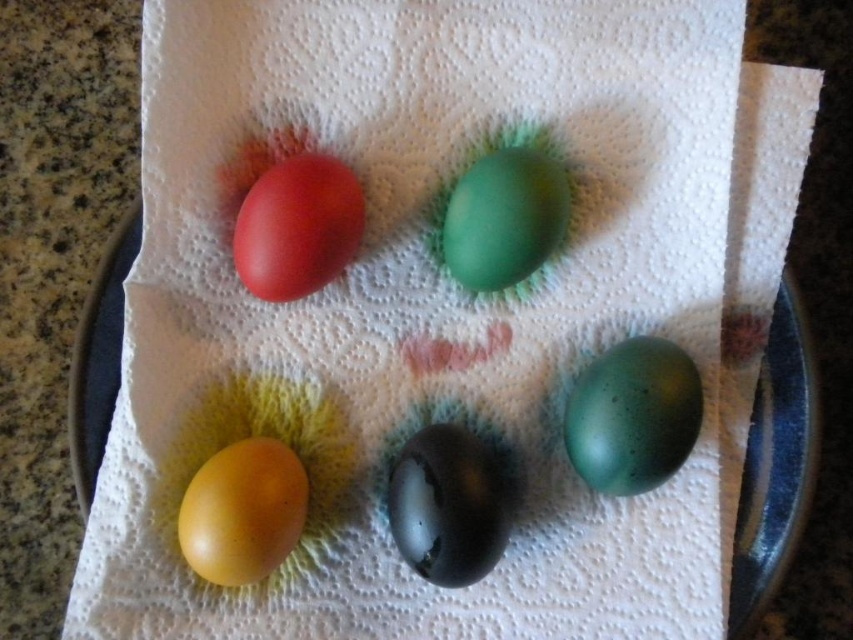
You are arranging eggs on a countertop and need to place a new egg between the speckled green egg at lower right and the matte red egg at upper left. Based on their positions, where should you place the new egg?

The new egg should be placed between the speckled green egg at lower right and the matte red egg at upper left, positioned above the speckled green egg at lower right and below the matte red egg at upper left since the speckled green egg at lower right is below the matte red egg at upper left.

You are a chef preparing an Easter basket and need to fit both the speckled green egg at lower right and the yellow matte egg at lower left. If the basket has a height limit of 10 cm, can both eggs fit vertically without overlapping?

The speckled green egg at lower right is larger in size than yellow matte egg at lower left. However, the exact heights of the eggs are not provided in the description. Therefore, it is uncertain if both can fit vertically within the 10 cm height limit without overlapping.

You are arranging eggs on a plate for an Easter basket. You have a speckled green egg at lower right and a yellow matte egg at lower left. According to the image, which egg is positioned higher on the plate?

The speckled green egg at lower right is positioned higher than the yellow matte egg at lower left because it is above it.